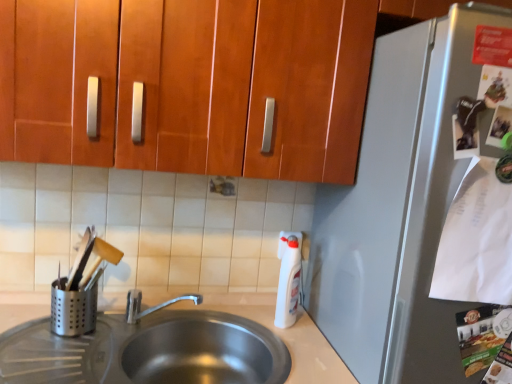
Question: Is satin silver refrigerator at right looking in the opposite direction of silver metallic utensil holder at left?

Choices:
 (A) yes
 (B) no

Answer: (B)

Question: Is the surface of satin silver refrigerator at right in direct contact with silver metallic utensil holder at left?

Choices:
 (A) no
 (B) yes

Answer: (A)

Question: Considering the relative sizes of satin silver refrigerator at right and silver metallic utensil holder at left in the image provided, is satin silver refrigerator at right taller than silver metallic utensil holder at left?

Choices:
 (A) yes
 (B) no

Answer: (A)

Question: Is satin silver refrigerator at right to the right of silver metallic utensil holder at left from the viewer's perspective?

Choices:
 (A) yes
 (B) no

Answer: (A)

Question: Is satin silver refrigerator at right wider than silver metallic utensil holder at left?

Choices:
 (A) yes
 (B) no

Answer: (A)

Question: Does satin silver refrigerator at right have a lesser height compared to silver metallic utensil holder at left?

Choices:
 (A) yes
 (B) no

Answer: (B)

Question: Is silver metallic utensil holder at left far from satin silver refrigerator at right?

Choices:
 (A) yes
 (B) no

Answer: (B)

Question: From the image's perspective, does silver metallic utensil holder at left appear lower than satin silver refrigerator at right?

Choices:
 (A) no
 (B) yes

Answer: (B)

Question: Is silver metallic utensil holder at left bigger than satin silver refrigerator at right?

Choices:
 (A) yes
 (B) no

Answer: (B)

Question: Can you confirm if silver metallic utensil holder at left is taller than satin silver refrigerator at right?

Choices:
 (A) yes
 (B) no

Answer: (B)

Question: Is silver metallic utensil holder at left oriented away from satin silver refrigerator at right?

Choices:
 (A) no
 (B) yes

Answer: (A)

Question: Is silver metallic utensil holder at left aimed at satin silver refrigerator at right?

Choices:
 (A) no
 (B) yes

Answer: (A)

Question: From a real-world perspective, is white plastic bottle at right on top of wooden cabinet at upper center?

Choices:
 (A) yes
 (B) no

Answer: (B)